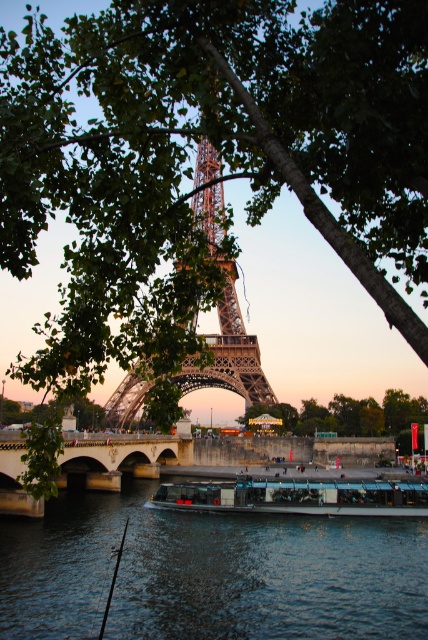
Question: Which object is positioned closest to the dark blue water at center?

Choices:
 (A) metallic brown eiffel tower at center
 (B) stone bridge at center

Answer: (B)

Question: Can you confirm if dark blue water at center is positioned above metallic glass boat at center?

Choices:
 (A) no
 (B) yes

Answer: (A)

Question: Does dark blue water at center appear under stone bridge at center?

Choices:
 (A) no
 (B) yes

Answer: (B)

Question: Is metallic brown eiffel tower at center above stone bridge at center?

Choices:
 (A) yes
 (B) no

Answer: (A)

Question: Which of the following is the farthest from the observer?

Choices:
 (A) stone bridge at center
 (B) metallic glass boat at center
 (C) metallic brown eiffel tower at center

Answer: (B)

Question: Which object appears farthest from the camera in this image?

Choices:
 (A) stone bridge at center
 (B) green leafy tree at center
 (C) metallic brown eiffel tower at center
 (D) dark blue water at center

Answer: (B)